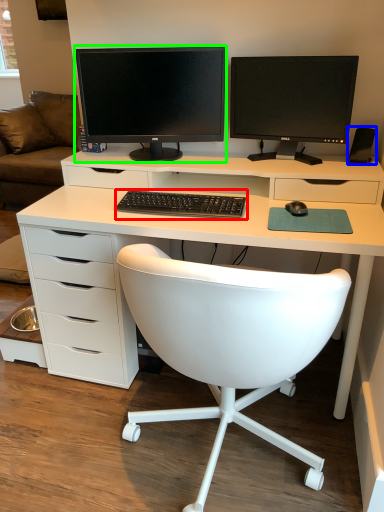
Question: Considering the real-world distances, which object is farthest from computer keyboard (highlighted by a red box)? speaker (highlighted by a blue box) or computer monitor (highlighted by a green box)?

Choices:
 (A) speaker
 (B) computer monitor

Answer: (A)